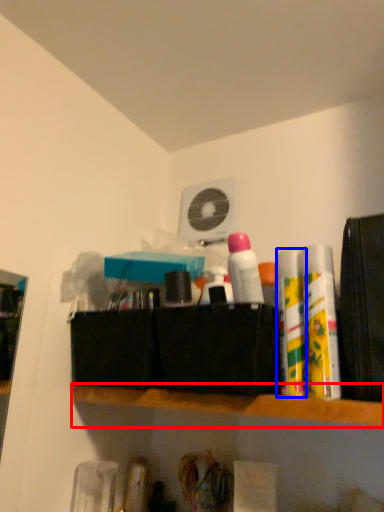
Question: Which object appears closest to the camera in this image, shelf (highlighted by a red box) or toiletry (highlighted by a blue box)?

Choices:
 (A) shelf
 (B) toiletry

Answer: (A)